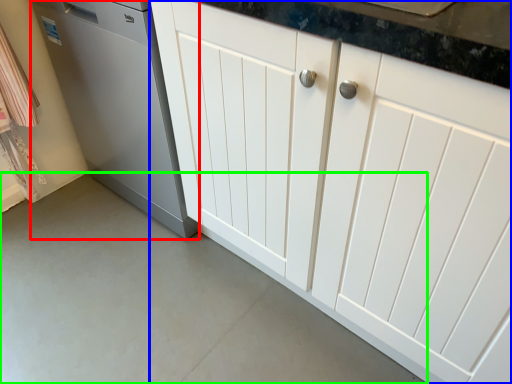
Question: Based on their relative distances, which object is farther from home appliance (highlighted by a red box)? Choose from cabinetry (highlighted by a blue box) and concrete (highlighted by a green box).

Choices:
 (A) cabinetry
 (B) concrete

Answer: (B)